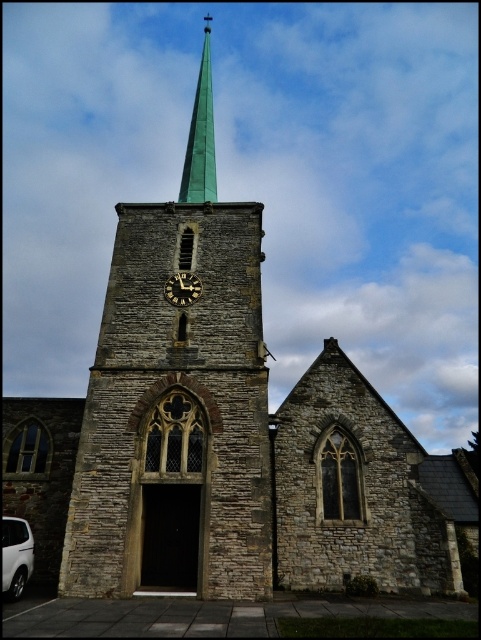
Based on the photo, you are standing in front of the church and notice the green glass spire at upper center and the gold metallic clock at center. Which object is positioned to the left of the other?

The green glass spire at upper center is to the left of the gold metallic clock at center.

You are standing in front of the church and want to take a photo of both the brown stone clock tower at center and the gold metallic clock at center. However, you notice that one of them is blocking the other. Which object is blocking the other?

The brown stone clock tower at center is in front of the gold metallic clock at center, so the brown stone clock tower at center is blocking the gold metallic clock at center.

You are a visitor standing in front of the church and see the white matte van at lower left and the gold metallic clock at center. Which object is positioned lower in the image?

The white matte van at lower left is positioned below the gold metallic clock at center, so it is lower in the image.